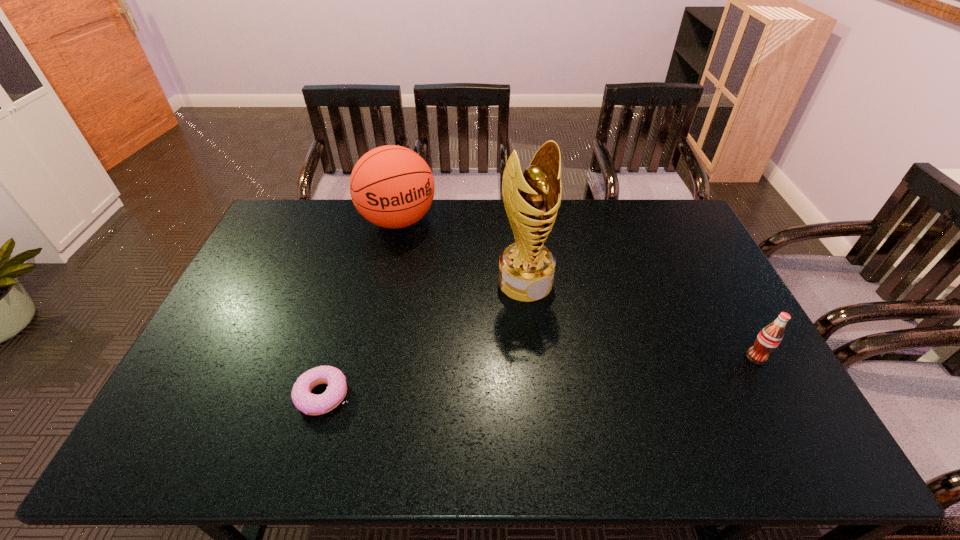
What are the coordinates of `vacant space on the desktop that is between the nearest object and the second nearest object and is positioned on the front-facing side of the award` in the screenshot? It's located at (593, 372).

Locate an element on the screen. free spot on the desktop that is between the shortest object and the soda and is positioned on the side with logo of the basketball is located at coordinates (492, 380).